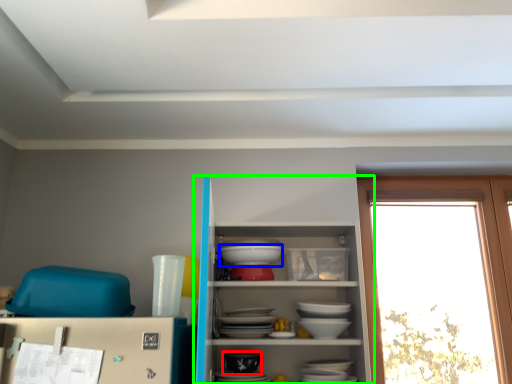
Question: Considering the real-world distances, which object is farthest from tableware (highlighted by a red box)? table (highlighted by a blue box) or shelf (highlighted by a green box)?

Choices:
 (A) table
 (B) shelf

Answer: (A)